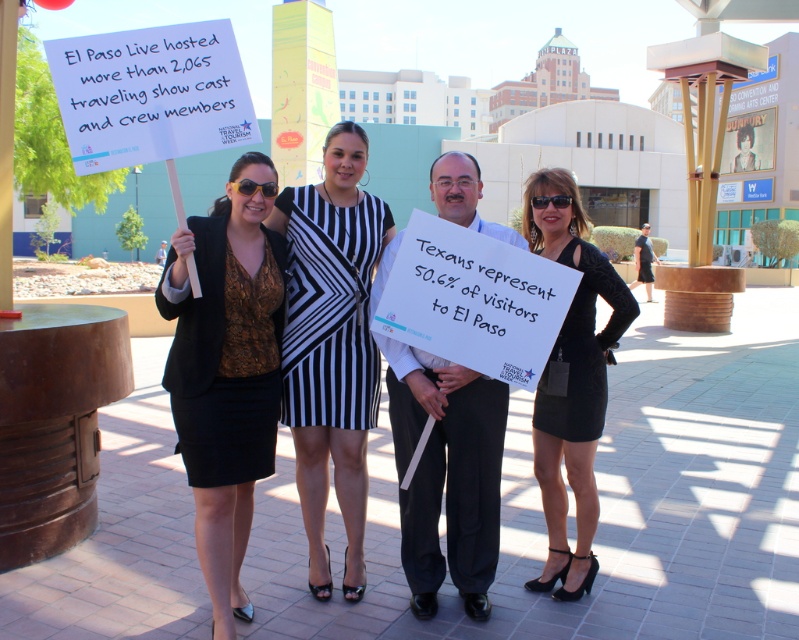
You are standing in the plaza and want to take a photo of the point at coordinates (356,292). If you are 3 meters away from it, will you need to move closer or farther to focus your camera properly?

The point at coordinates (356,292) is 3.55 meters away from the viewer. Since you are currently 3 meters away, you need to move 0.55 meters farther to be at the correct distance of 3.55 meters.

You are standing at the point with coordinates point (344,445) and want to walk to the point with coordinates point (237,273). Which direction should you move?

You should move forward because point (237,273) is in front of point (344,445).